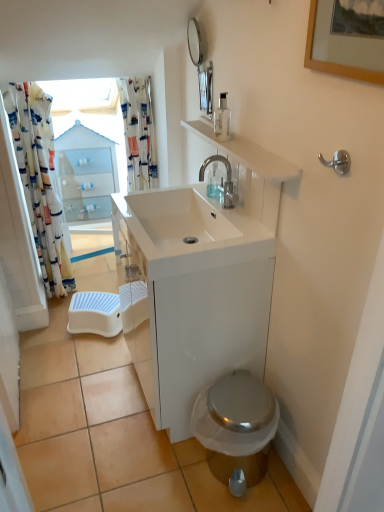
This screenshot has width=384, height=512. Find the location of `vacant space to the right of white printed fabric shower curtain at left, positioned as the second shower curtain in right-to-left order`. vacant space to the right of white printed fabric shower curtain at left, positioned as the second shower curtain in right-to-left order is located at coordinates (108, 283).